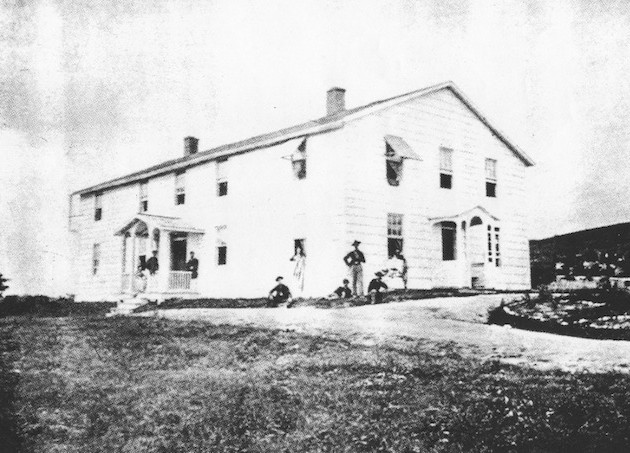
Where is `chimney`? chimney is located at coordinates click(333, 111), click(186, 149).